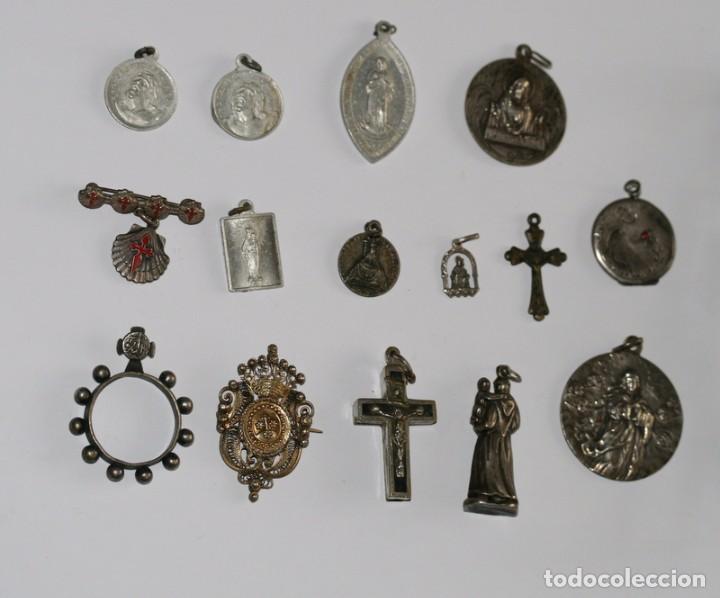
Find the location of a particular element. The width and height of the screenshot is (720, 598). trinkets in bottom row is located at coordinates (180, 432), (281, 422), (407, 416), (505, 416), (624, 401).